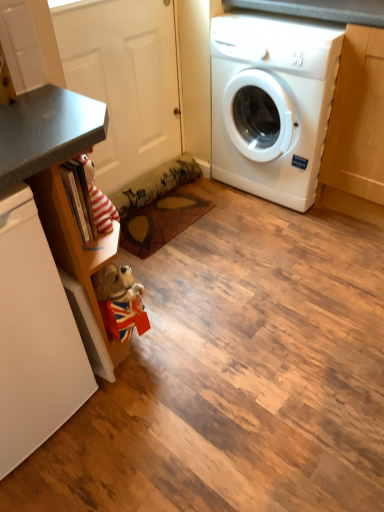
Identify the location of free space in front of white glossy washing machine at right. The height and width of the screenshot is (512, 384). (279, 239).